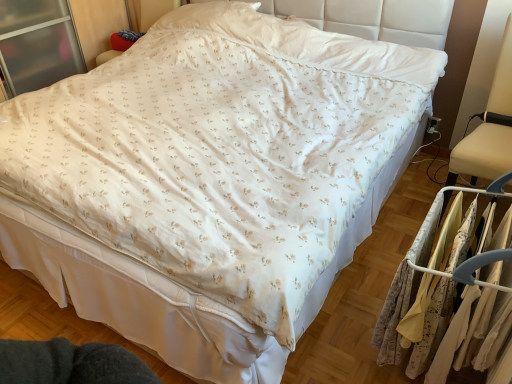
Question: Does silky beige fabric at right have a smaller size compared to floral fabric dress at right?

Choices:
 (A) no
 (B) yes

Answer: (A)

Question: Is floral fabric dress at right inside silky beige fabric at right?

Choices:
 (A) no
 (B) yes

Answer: (B)

Question: Is floral fabric dress at right at the back of silky beige fabric at right?

Choices:
 (A) yes
 (B) no

Answer: (A)

Question: Is silky beige fabric at right behind floral fabric dress at right?

Choices:
 (A) no
 (B) yes

Answer: (A)

Question: From a real-world perspective, does silky beige fabric at right stand above floral fabric dress at right?

Choices:
 (A) yes
 (B) no

Answer: (A)

Question: Is point (496, 74) closer or farther from the camera than point (375, 337)?

Choices:
 (A) farther
 (B) closer

Answer: (A)

Question: Considering the relative positions of beige fabric swivel chair at right and floral fabric dress at right in the image provided, is beige fabric swivel chair at right to the left or to the right of floral fabric dress at right?

Choices:
 (A) right
 (B) left

Answer: (A)

Question: Relative to floral fabric dress at right, is beige fabric swivel chair at right in front or behind?

Choices:
 (A) front
 (B) behind

Answer: (B)

Question: From their relative heights in the image, would you say beige fabric swivel chair at right is taller or shorter than floral fabric dress at right?

Choices:
 (A) tall
 (B) short

Answer: (A)

Question: From their relative heights in the image, would you say floral fabric dress at right is taller or shorter than beige fabric swivel chair at right?

Choices:
 (A) tall
 (B) short

Answer: (B)

Question: From the image's perspective, relative to beige fabric swivel chair at right, is floral fabric dress at right above or below?

Choices:
 (A) above
 (B) below

Answer: (B)

Question: Based on their sizes in the image, would you say floral fabric dress at right is bigger or smaller than beige fabric swivel chair at right?

Choices:
 (A) big
 (B) small

Answer: (B)

Question: Is floral fabric dress at right to the left or to the right of beige fabric swivel chair at right in the image?

Choices:
 (A) left
 (B) right

Answer: (A)

Question: In the image, is silky beige fabric at right positioned in front of or behind beige fabric swivel chair at right?

Choices:
 (A) behind
 (B) front

Answer: (B)

Question: Is silky beige fabric at right bigger or smaller than beige fabric swivel chair at right?

Choices:
 (A) big
 (B) small

Answer: (A)